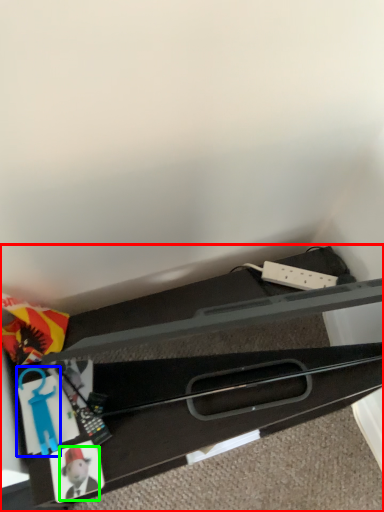
Question: Which is nearer to the furniture (highlighted by a red box)? toy (highlighted by a blue box) or toy (highlighted by a green box).

Choices:
 (A) toy
 (B) toy

Answer: (A)